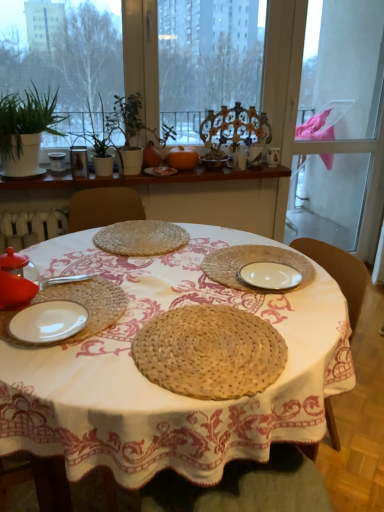
Question: Should I look upward or downward to see woven straw placemat at center, which ranks as the 2th plate in back-to-front order?

Choices:
 (A) down
 (B) up

Answer: (B)

Question: Considering the relative positions of transparent glass window screen at upper center and white glossy plate at lower left, arranged as the 2th plate when viewed from the front, in the image provided, is transparent glass window screen at upper center behind white glossy plate at lower left, arranged as the 2th plate when viewed from the front,?

Choices:
 (A) no
 (B) yes

Answer: (B)

Question: From the image's perspective, is transparent glass window screen at upper center under white glossy plate at lower left, arranged as the 2th plate when viewed from the front?

Choices:
 (A) no
 (B) yes

Answer: (A)

Question: From the image's perspective, is transparent glass window screen at upper center over white glossy plate at lower left, which is the fourth plate in back-to-front order?

Choices:
 (A) no
 (B) yes

Answer: (B)

Question: Is transparent glass window screen at upper center positioned with its back to white glossy plate at lower left, the fifth plate viewed from the top?

Choices:
 (A) no
 (B) yes

Answer: (A)

Question: From a real-world perspective, is transparent glass window screen at upper center below white glossy plate at lower left, which is the fourth plate in back-to-front order?

Choices:
 (A) no
 (B) yes

Answer: (A)

Question: Is transparent glass window screen at upper center beside white glossy plate at lower left, the fifth plate viewed from the top?

Choices:
 (A) no
 (B) yes

Answer: (A)

Question: Is transparent glass screen door at right placed right next to matte glass vase at upper left, the fourth tableware viewed from the top?

Choices:
 (A) yes
 (B) no

Answer: (B)

Question: Considering the relative positions of transparent glass screen door at right and matte glass vase at upper left, which is counted as the 2th tableware, starting from the bottom, in the image provided, is transparent glass screen door at right to the left of matte glass vase at upper left, which is counted as the 2th tableware, starting from the bottom, from the viewer's perspective?

Choices:
 (A) no
 (B) yes

Answer: (A)

Question: Considering the relative sizes of transparent glass screen door at right and matte glass vase at upper left, which is counted as the 2th tableware, starting from the bottom, in the image provided, is transparent glass screen door at right wider than matte glass vase at upper left, which is counted as the 2th tableware, starting from the bottom,?

Choices:
 (A) yes
 (B) no

Answer: (B)

Question: From a real-world perspective, is transparent glass screen door at right under matte glass vase at upper left, arranged as the second tableware when viewed from the front?

Choices:
 (A) yes
 (B) no

Answer: (B)

Question: Is the position of transparent glass screen door at right more distant than that of matte glass vase at upper left, arranged as the second tableware when viewed from the front?

Choices:
 (A) no
 (B) yes

Answer: (B)

Question: From the image's perspective, does transparent glass screen door at right appear higher than matte glass vase at upper left, which appears as the 5th tableware when viewed from the right?

Choices:
 (A) no
 (B) yes

Answer: (B)

Question: From the image's perspective, does green matte plant at upper center, the 2th plant when ordered from left to right, appear higher than matte brown bowl at center, the third tableware viewed from the right?

Choices:
 (A) yes
 (B) no

Answer: (A)